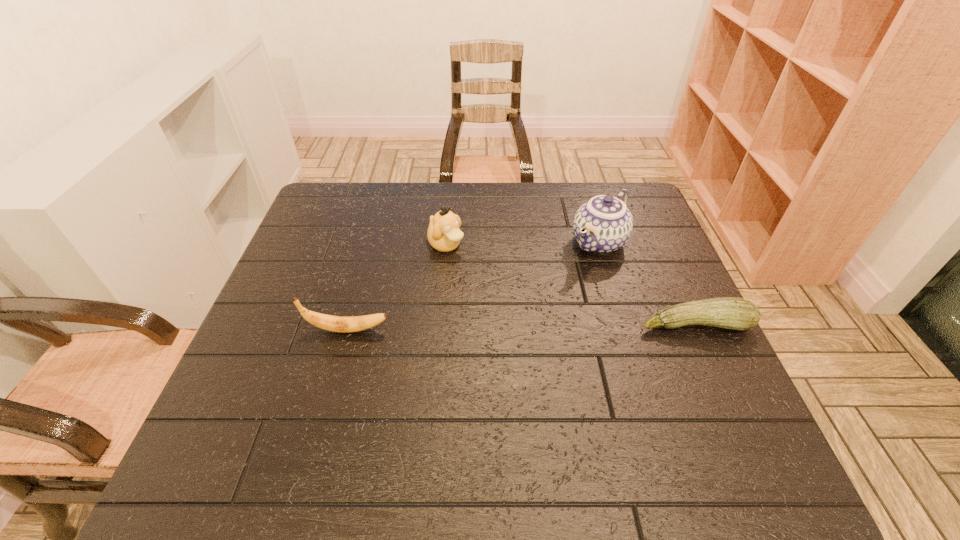
At what (x,y) coordinates should I click in order to perform the action: click on free space between the duckling and the third tallest object. Please return your answer as a coordinate pair (x, y). Looking at the image, I should click on (396, 288).

I want to click on blank region between the third tallest object and the duckling, so click(396, 288).

You are a GUI agent. You are given a task and a screenshot of the screen. Output one action in this format:
    pyautogui.click(x=<x>, y=<y>)
    Task: Click on the free space that is in between the chinaware and the leftmost object
    This screenshot has width=960, height=540.
    Given the screenshot: What is the action you would take?
    pyautogui.click(x=473, y=286)

Where is `empty location between the zucchini and the tallest object`? This screenshot has width=960, height=540. empty location between the zucchini and the tallest object is located at coordinates (647, 284).

The image size is (960, 540). I want to click on the closest object to the chinaware, so (734, 313).

Select which object appears as the third closest to the tallest object. Please provide its 2D coordinates. Your answer should be formatted as a tuple, i.e. [(x, y)], where the tuple contains the x and y coordinates of a point satisfying the conditions above.

[(332, 323)]